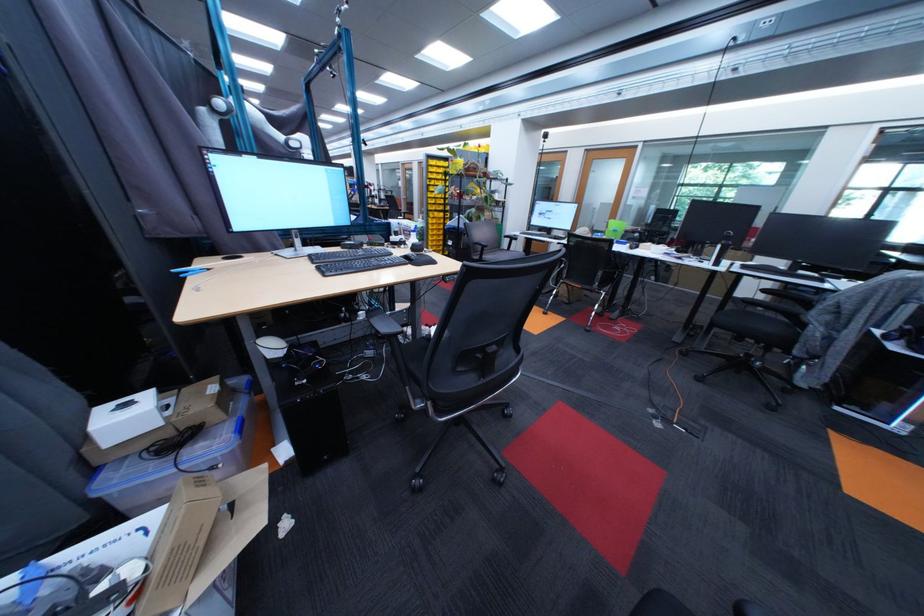
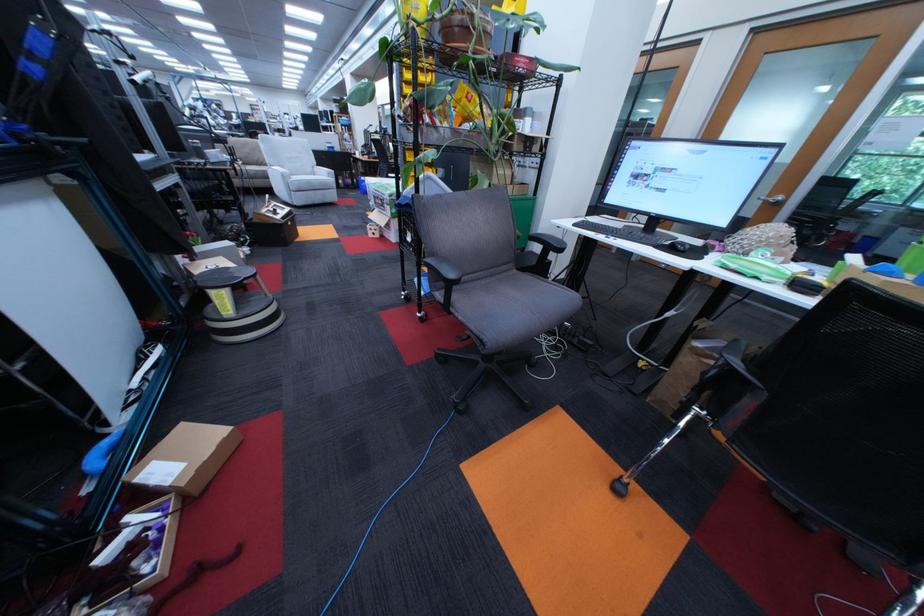
Question: Which direction would the cameraman need to move to produce the second image? Reply with the corresponding letter.

Choices:
 (A) Left
 (B) Right
 (C) Forward
 (D) Backward

Answer: (C)